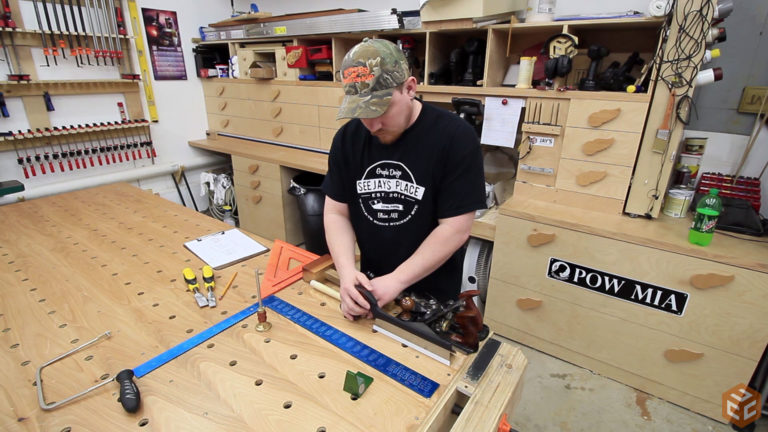
Where is `fan`? fan is located at coordinates (475, 262).